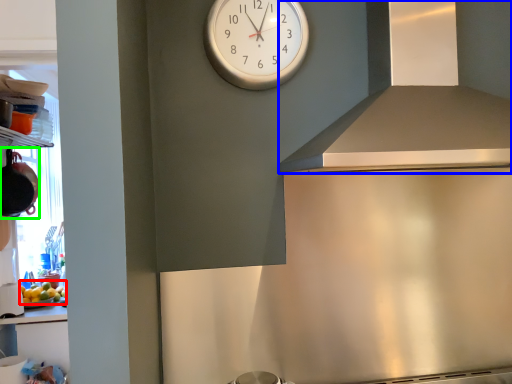
Question: Estimate the real-world distances between objects in this image. Which object is closer to food (highlighted by a red box), exhaust hood (highlighted by a blue box) or appliance (highlighted by a green box)?

Choices:
 (A) exhaust hood
 (B) appliance

Answer: (B)